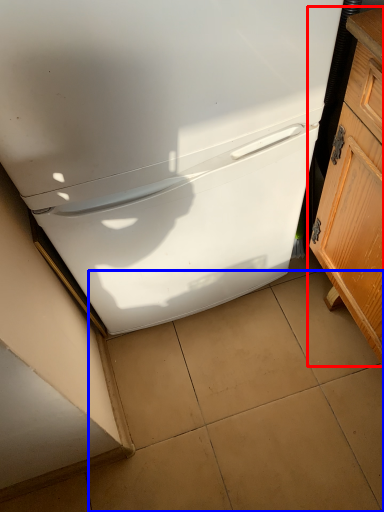
Question: Which object appears farthest to the camera in this image, cabinetry (highlighted by a red box) or tile (highlighted by a blue box)?

Choices:
 (A) cabinetry
 (B) tile

Answer: (B)